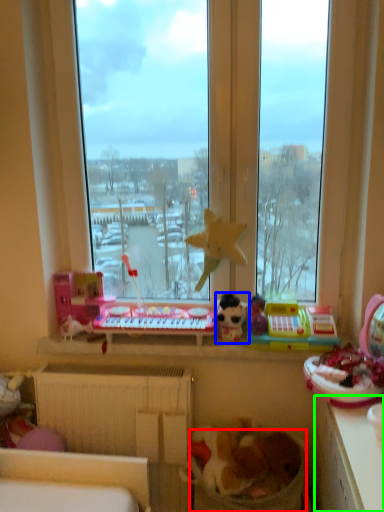
Question: Estimate the real-world distances between objects in this image. Which object is closer to laundry basket (highlighted by a red box), toy (highlighted by a blue box) or counter top (highlighted by a green box)?

Choices:
 (A) toy
 (B) counter top

Answer: (B)